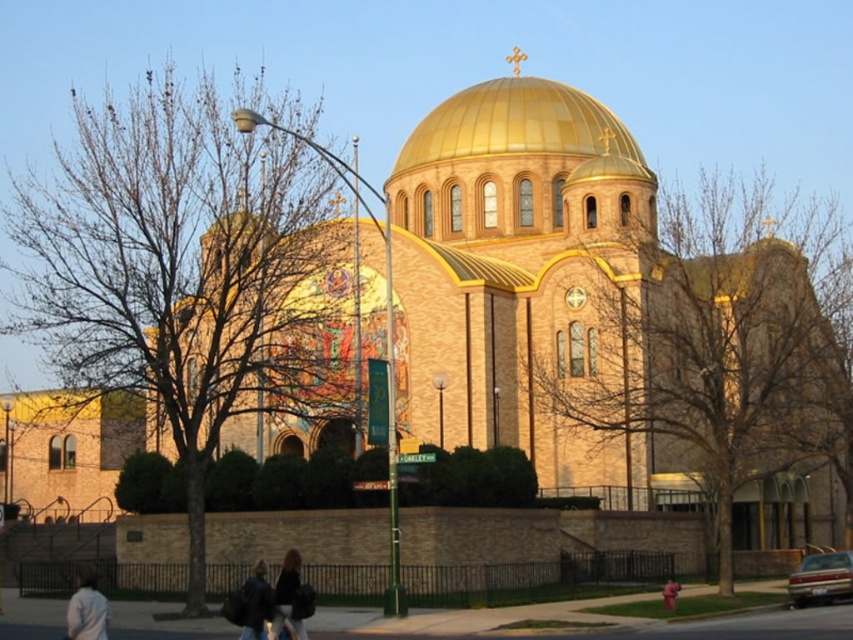
You are a photographer planning to take a wide shot of the church. You need to ensure that both the metallic silver sedan at lower right and the light gray jacket at lower left are fully visible in the frame. Given their sizes, which object might require you to adjust your camera angle to include it in the shot?

The light gray jacket at lower left might require adjusting the camera angle because it occupies more space than the metallic silver sedan at lower right, so it might be harder to fit into the frame if it is larger.

You are an architect visiting the church and want to compare the height of the gold polished dome at upper center and the dark brown leather jacket at lower center. Which one is taller?

The gold polished dome at upper center is much taller than the dark brown leather jacket at lower center.